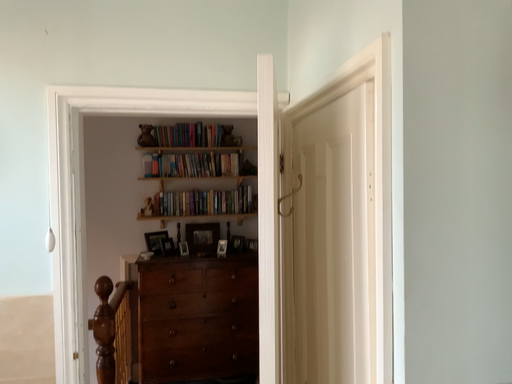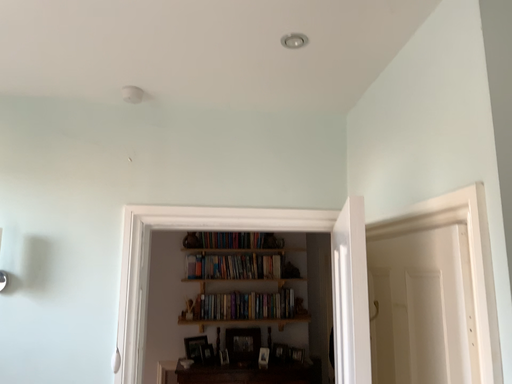
Question: Which way did the camera rotate in the video?

Choices:
 (A) rotated downward
 (B) rotated upward

Answer: (B)